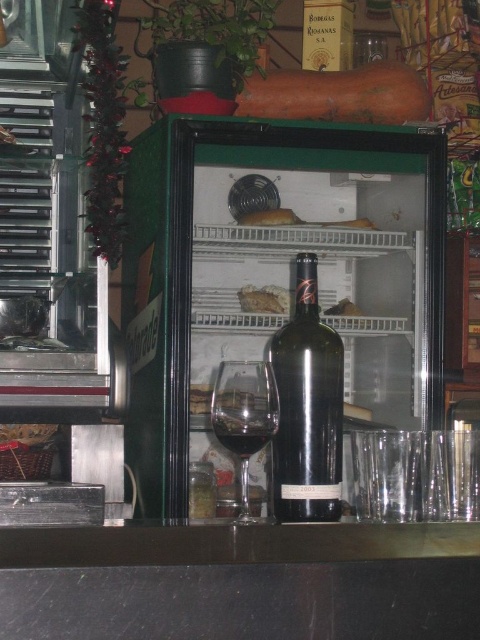
You are a delivery person who needs to place a new item at the exact location of point (x=340, y=416) in the refrigerated display case. The item is 12 inches tall. Can you determine if there is enough vertical space between the shelf above and the shelf below this point to safely place the item without it touching either shelf?

The point (x=340, y=416) is 33.31 inches from the camera. However, the vertical distance between the shelves isnot provided in the description, so it is impossible to determine if there is enough space to place the item without it touching the shelves.

From the picture: You are a bartender preparing a drink and need to place a small ice cube tray on the counter. The ice cube tray is 10 cm tall. Can the black granite counter at lower center support the black glass bottle at center without it toppling over?

The black granite counter at lower center is not as tall as the black glass bottle at center, so the bottle may be prone to toppling over if placed there due to the counter being shorter than the bottle.